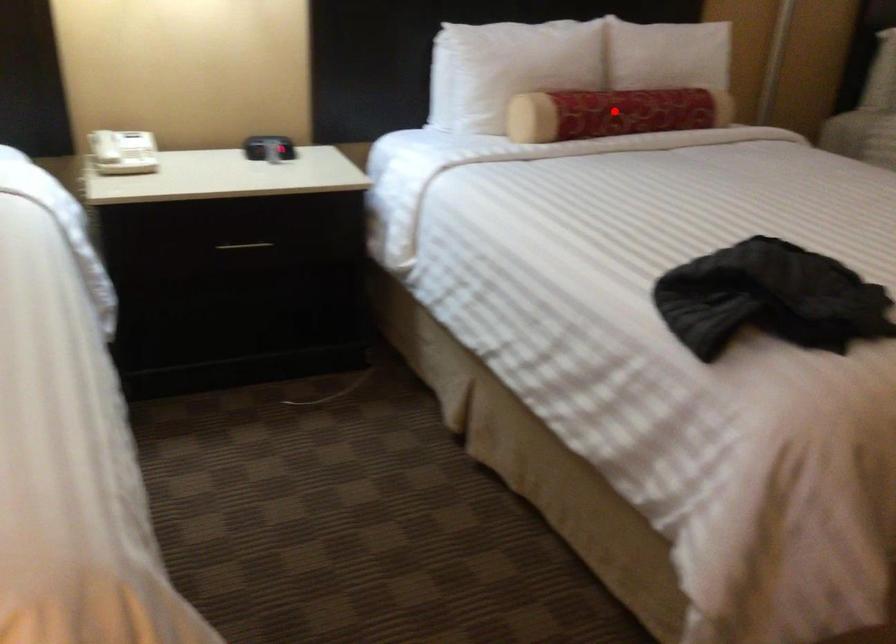
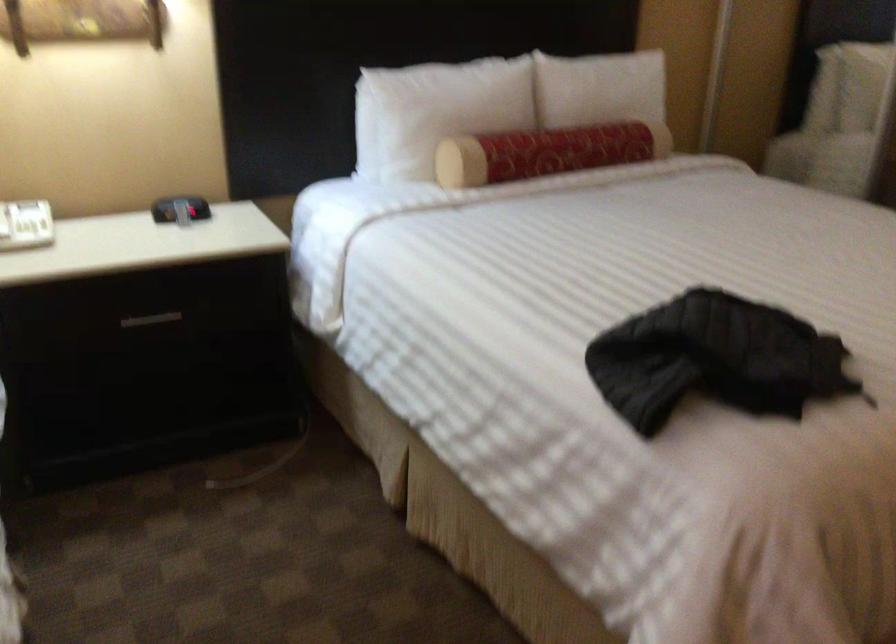
Question: I am providing you with two images of the same scene from different viewpoints. A red point is marked on the first image. At the location where the point appears in image 1, is it still visible in image 2?

Choices:
 (A) Yes
 (B) No

Answer: (A)